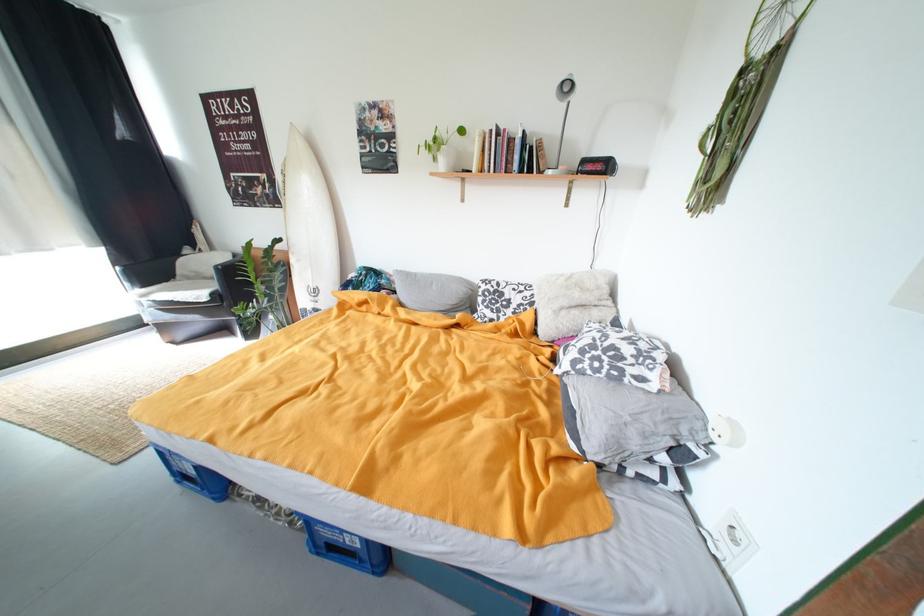
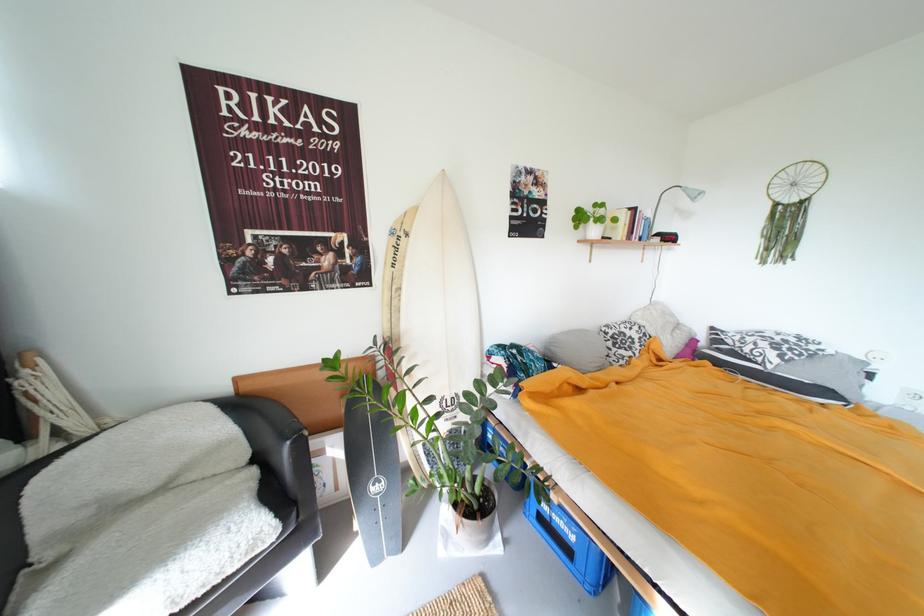
In the second image, find the point that corresponds to the point at 488,290 in the first image.

(614, 334)